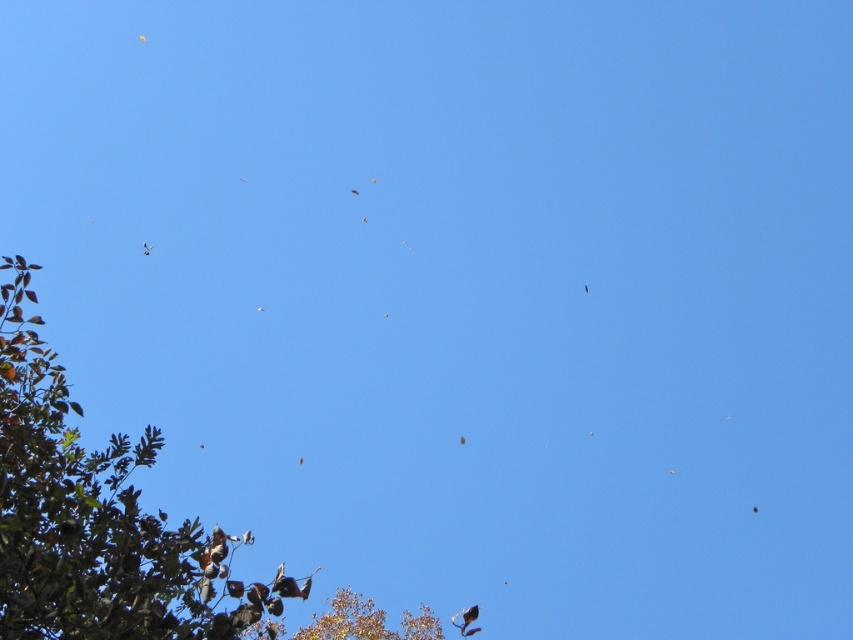
Question: Which point appears farthest from the camera in this image?

Choices:
 (A) (354, 188)
 (B) (149, 244)
 (C) (314, 628)

Answer: (B)

Question: Which of the following is the farthest from the observer?

Choices:
 (A) (340, 636)
 (B) (357, 193)
 (C) (479, 611)
 (D) (22, 605)

Answer: (B)

Question: Is smooth feathered bird at center bigger than brown feathered bird at center?

Choices:
 (A) no
 (B) yes

Answer: (A)

Question: Is brown leafy tree at left wider than brown leafy tree at lower left?

Choices:
 (A) no
 (B) yes

Answer: (A)

Question: Estimate the real-world distances between objects in this image. Which object is closer to the smooth feathered bird at center?

Choices:
 (A) brown leafy tree at left
 (B) brown feathered bird at center
 (C) brown leafy tree at lower left

Answer: (B)

Question: Does shiny black bird at bottom right appear over smooth feathered bird at center?

Choices:
 (A) yes
 (B) no

Answer: (B)